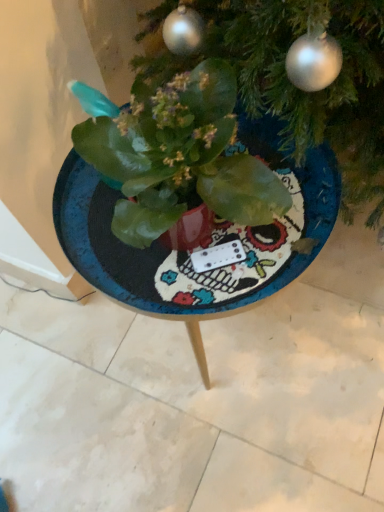
Locate an element on the screen. blue textured table at center is located at coordinates coord(213,234).

What do you see at coordinates (213, 234) in the screenshot? I see `blue textured table at center` at bounding box center [213, 234].

In order to face blue textured table at center, should I rotate leftwards or rightwards?

Turn right approximately 0.854 degrees to face it.

This screenshot has height=512, width=384. I want to click on blue textured table at center, so click(x=213, y=234).